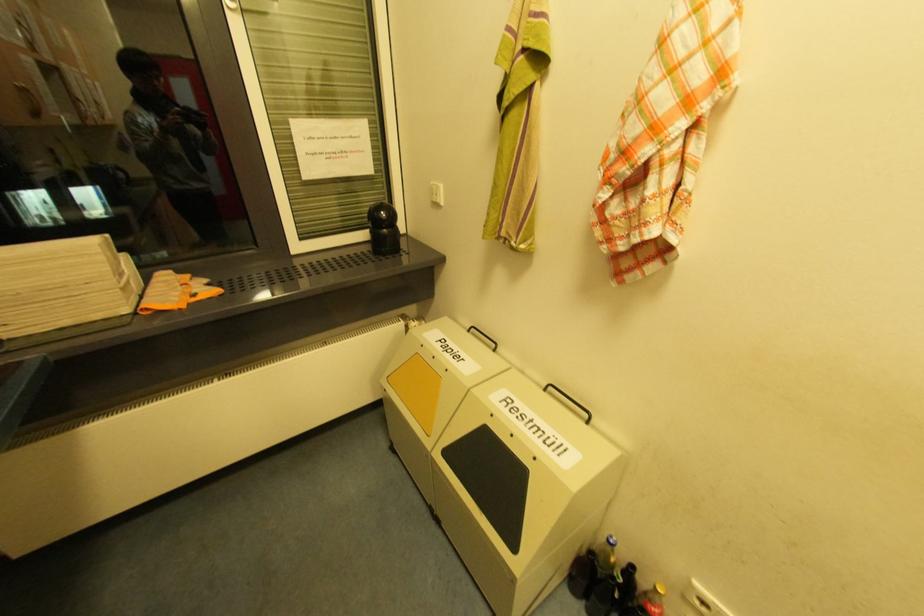
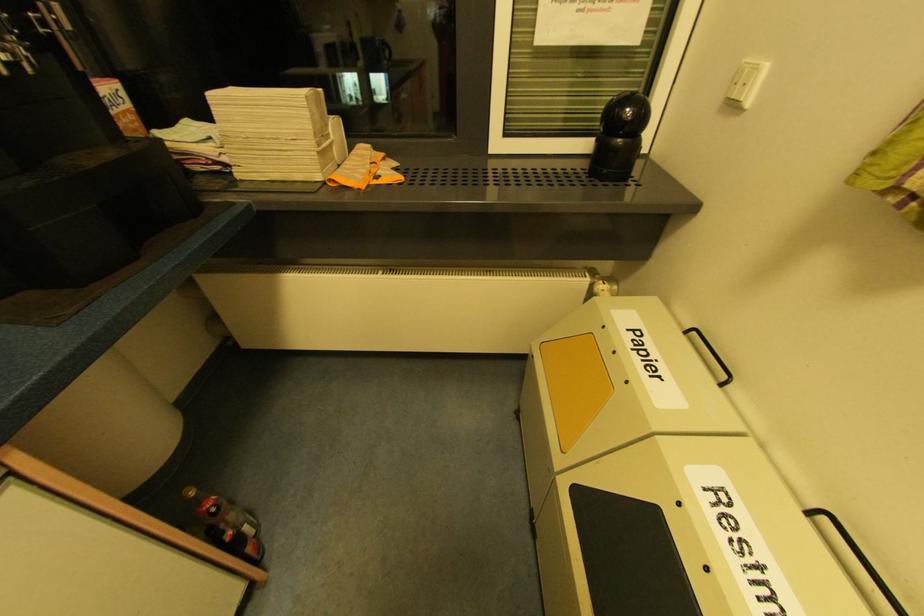
How did the camera likely rotate?

The camera rotated toward left-down.